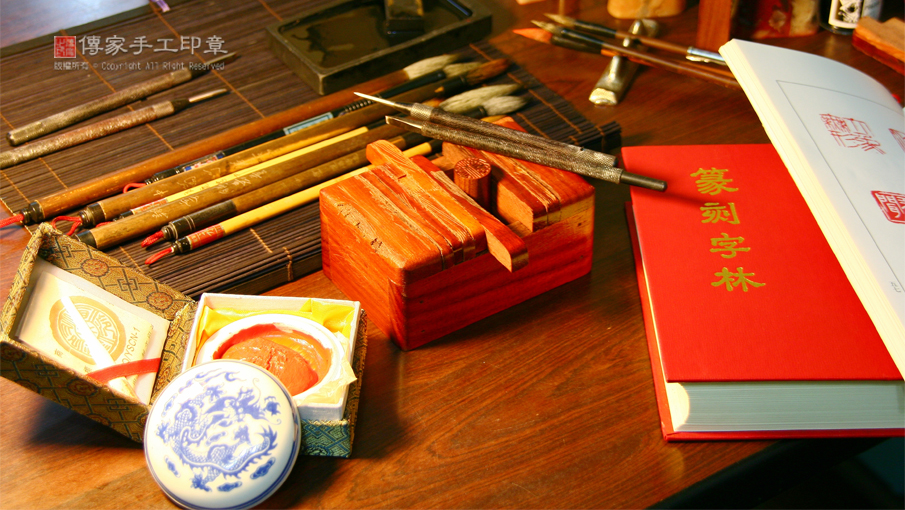
Where is `small wooden box`? This screenshot has height=510, width=905. small wooden box is located at coordinates (450, 308).